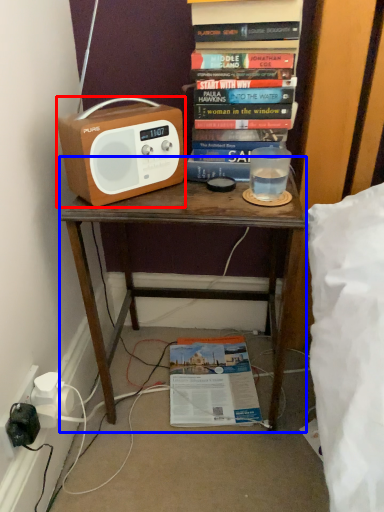
Question: Among these objects, which one is farthest to the camera, cassette (highlighted by a red box) or desk (highlighted by a blue box)?

Choices:
 (A) cassette
 (B) desk

Answer: (B)